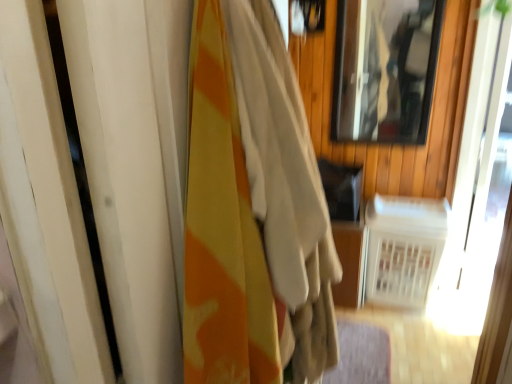
Question: From the image's perspective, is camouflage fabric curtain at left located above or below clear glass mirror at upper right?

Choices:
 (A) above
 (B) below

Answer: (B)

Question: From a real-world perspective, is camouflage fabric curtain at left positioned above or below clear glass mirror at upper right?

Choices:
 (A) above
 (B) below

Answer: (B)

Question: Based on their relative distances, which object is nearer to the clear glass mirror at upper right?

Choices:
 (A) camouflage fabric curtain at left
 (B) white plastic radiator at lower right

Answer: (B)

Question: Estimate the real-world distances between objects in this image. Which object is closer to the camouflage fabric curtain at left?

Choices:
 (A) white plastic radiator at lower right
 (B) clear glass mirror at upper right

Answer: (A)